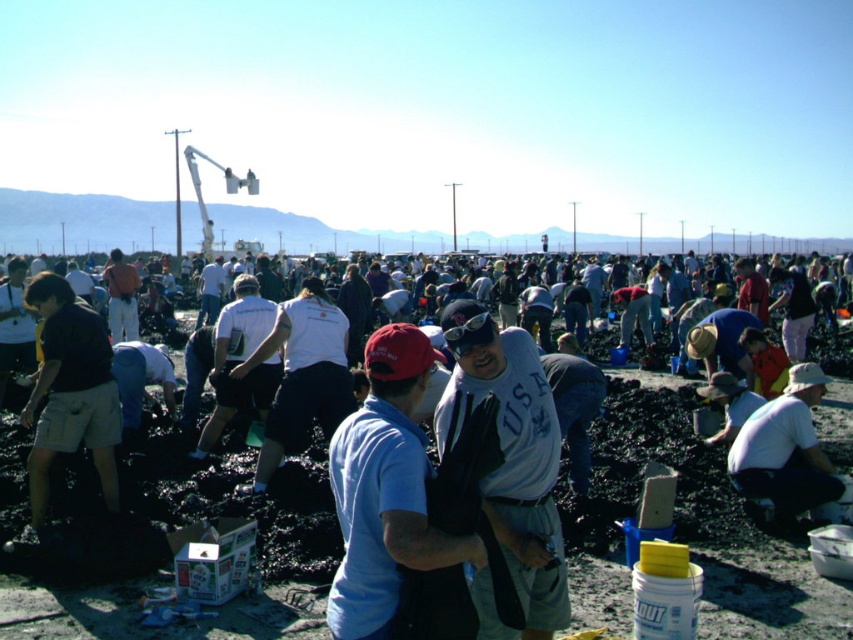
Question: Which of the following is the farthest from the observer?

Choices:
 (A) (515, 337)
 (B) (808, 454)

Answer: (B)

Question: Which is nearer to the white cotton shirt at lower right?

Choices:
 (A) matte gray shirt at center
 (B) gray cotton t-shirt at center
 (C) white cotton shirt at center
 (D) dark khaki shorts at left

Answer: (A)

Question: Can you confirm if dark khaki shorts at left is smaller than white cotton shirt at lower right?

Choices:
 (A) yes
 (B) no

Answer: (B)

Question: Is gray cotton t-shirt at center below white cotton shirt at center?

Choices:
 (A) no
 (B) yes

Answer: (B)

Question: Is gray cotton t-shirt at center smaller than white cotton shirt at lower right?

Choices:
 (A) no
 (B) yes

Answer: (B)

Question: Which object is the farthest from the white cotton shirt at center?

Choices:
 (A) white cotton shirt at lower right
 (B) matte gray shirt at center
 (C) gray cotton t-shirt at center

Answer: (C)